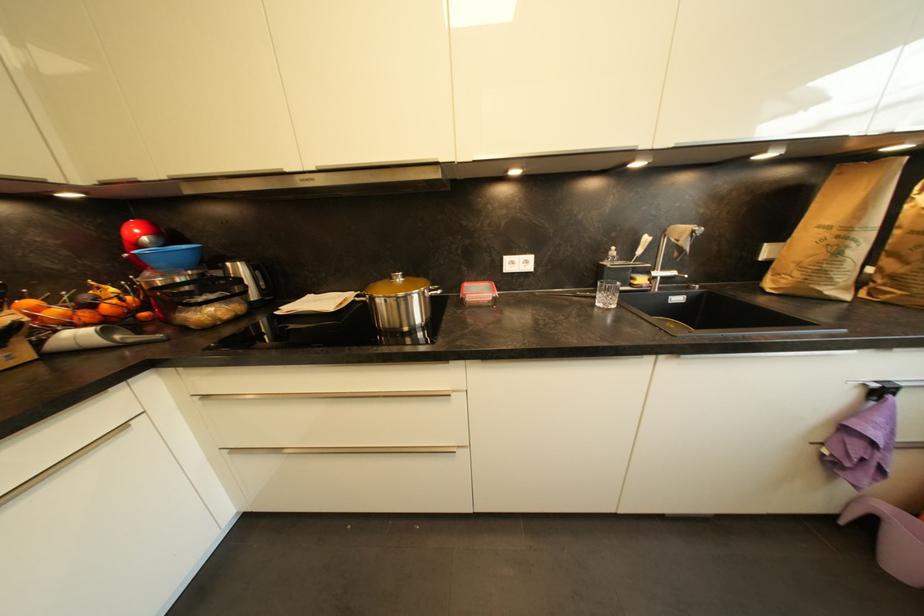
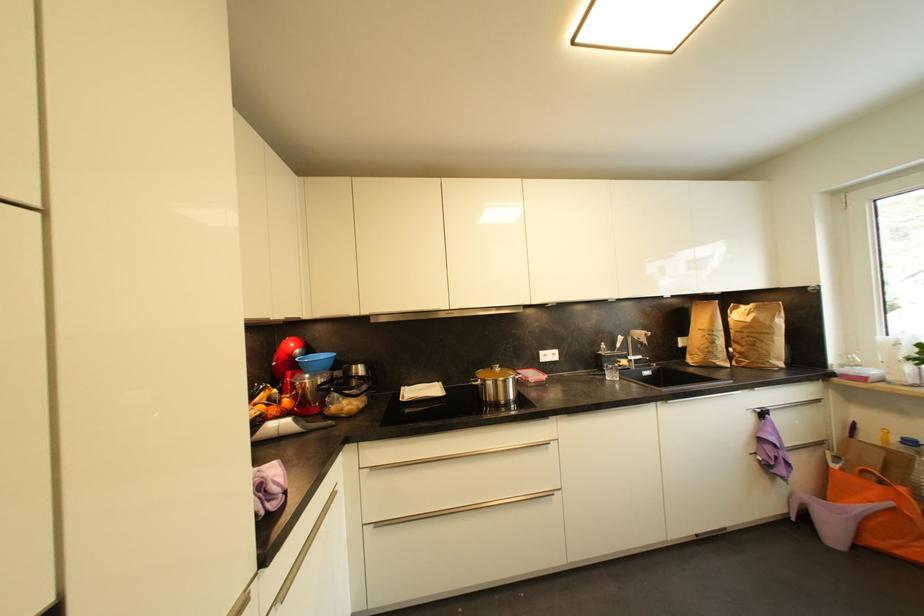
The point at (678, 275) is marked in the first image. Where is the corresponding point in the second image?

(645, 359)